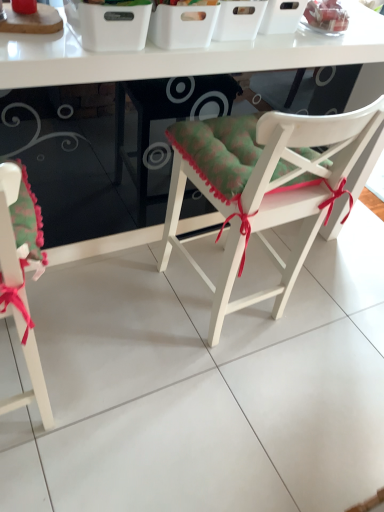
Identify the location of free point behind matte green cushion at lower left, acting as the 2th chair starting from the right. (73, 311).